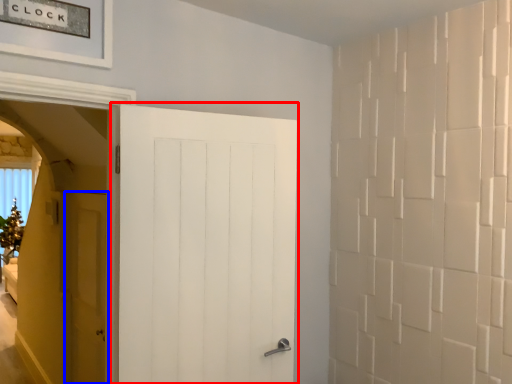
Question: Which of the following is the closest to the observer, door (highlighted by a red box) or door (highlighted by a blue box)?

Choices:
 (A) door
 (B) door

Answer: (A)